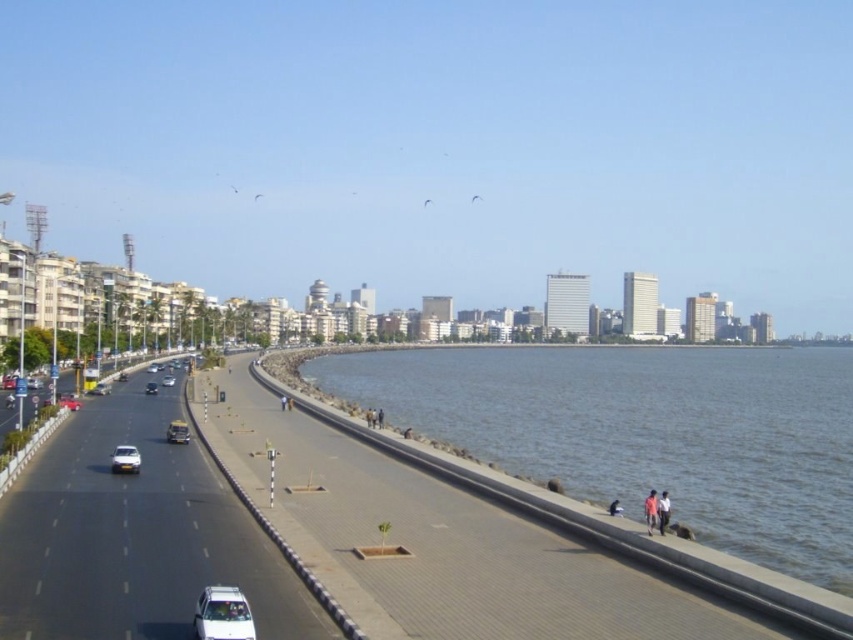
Question: Which point appears farthest from the camera in this image?

Choices:
 (A) (154, 381)
 (B) (659, 525)
 (C) (122, 456)
 (D) (624, 355)

Answer: (D)

Question: Which of these objects is positioned farthest from the light brown fabric shirt at lower right?

Choices:
 (A) silver metallic car at center-left
 (B) gray concrete water at center
 (C) pink fabric person at lower right

Answer: (B)

Question: Based on their relative distances, which object is farther from the light brown fabric shirt at lower right?

Choices:
 (A) pink fabric person at lower right
 (B) metallic silver car at center-left
 (C) silver metallic car at center-left

Answer: (C)

Question: Can you confirm if gray concrete water at center is positioned above pink fabric person at lower right?

Choices:
 (A) yes
 (B) no

Answer: (A)

Question: Is black asphalt highway at center wider than shiny silver car at center-left?

Choices:
 (A) yes
 (B) no

Answer: (A)

Question: Is light brown fabric shirt at lower right further to the viewer compared to shiny silver car at center-left?

Choices:
 (A) no
 (B) yes

Answer: (A)